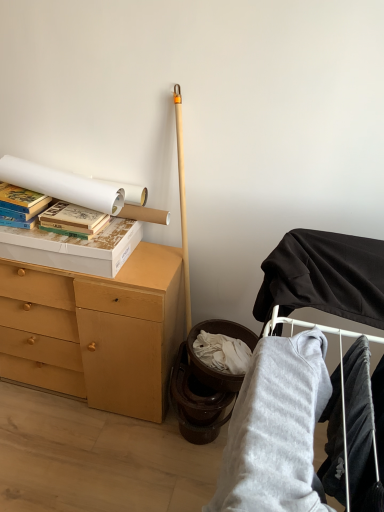
Question: In terms of height, does white cardboard box at upper left look taller or shorter compared to gray fleece sweatshirt at lower right, the 1th clothing positioned from the left?

Choices:
 (A) tall
 (B) short

Answer: (B)

Question: In the image, is white cardboard box at upper left on the left side or the right side of gray fleece sweatshirt at lower right, the 1th clothing positioned from the left?

Choices:
 (A) right
 (B) left

Answer: (B)

Question: Which is farther from the white cardboard box at upper left?

Choices:
 (A) hardcover books at left, marked as the first paperback book in a left-to-right arrangement
 (B) light brown wood chest of drawers at left
 (C) gray fleece sweatshirt at lower right, the 1th clothing positioned from the left
 (D) velvet black pants at lower right, the 2th clothing from the left
 (E) black matte fabric at upper right

Answer: (D)

Question: Which is nearer to the light brown wood chest of drawers at left?

Choices:
 (A) gray fleece sweatshirt at lower right, positioned as the 2th clothing in right-to-left order
 (B) matte cardboard book at upper left, the 2th paperback book viewed from the left
 (C) black matte fabric at upper right
 (D) white cardboard box at upper left
 (E) hardcover books at left, marked as the first paperback book in a left-to-right arrangement

Answer: (D)